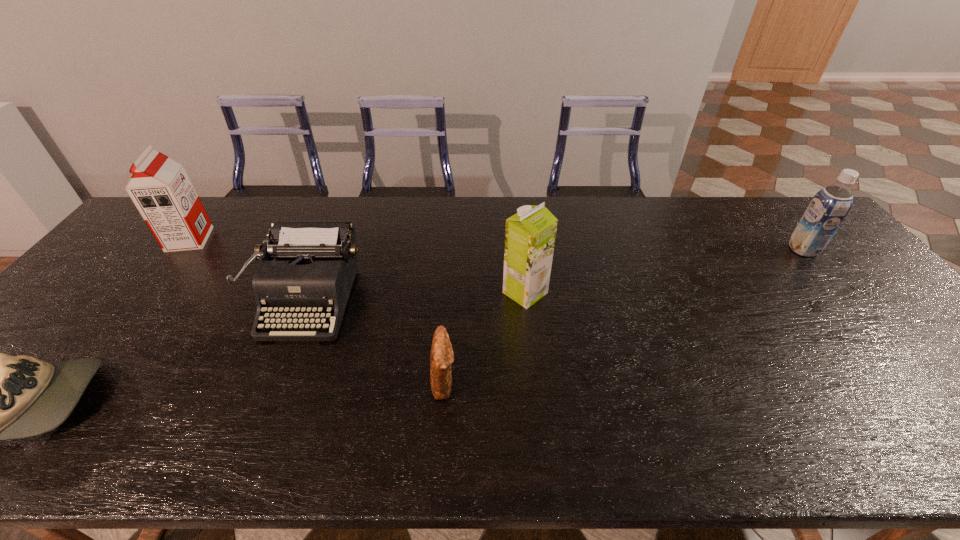
The image size is (960, 540). Find the location of `vacant area that lies between the second shortest object and the rightmost soya milk`. vacant area that lies between the second shortest object and the rightmost soya milk is located at coordinates (624, 315).

At what (x,y) coordinates should I click in order to perform the action: click on object that is the fifth nearest to the third shortest object. Please return your answer as a coordinate pair (x, y). This screenshot has width=960, height=540. Looking at the image, I should click on (829, 207).

Locate an element on the screen. The image size is (960, 540). object that stands as the closest to the shortest object is located at coordinates (315, 265).

This screenshot has height=540, width=960. What are the coordinates of `soya milk identified as the closest to the leftmost soya milk` in the screenshot? It's located at (x=530, y=234).

Where is `soya milk object that ranks as the third closest to the fourth object from right to left`? soya milk object that ranks as the third closest to the fourth object from right to left is located at coordinates click(x=829, y=207).

Identify the location of free space that satisfies the following two spatial constraints: 1. on the front side of the second soya milk from left to right; 2. on the open side of the fourth object from left to right. The width and height of the screenshot is (960, 540). (535, 381).

The image size is (960, 540). What are the coordinates of `vacant space that satisfies the following two spatial constraints: 1. on the label of the rightmost object; 2. on the front-facing side of the fourth tallest object` in the screenshot? It's located at (844, 298).

Identify the location of vacant space that satisfies the following two spatial constraints: 1. on the front side of the leftmost soya milk; 2. on the left side of the nearest soya milk. (149, 293).